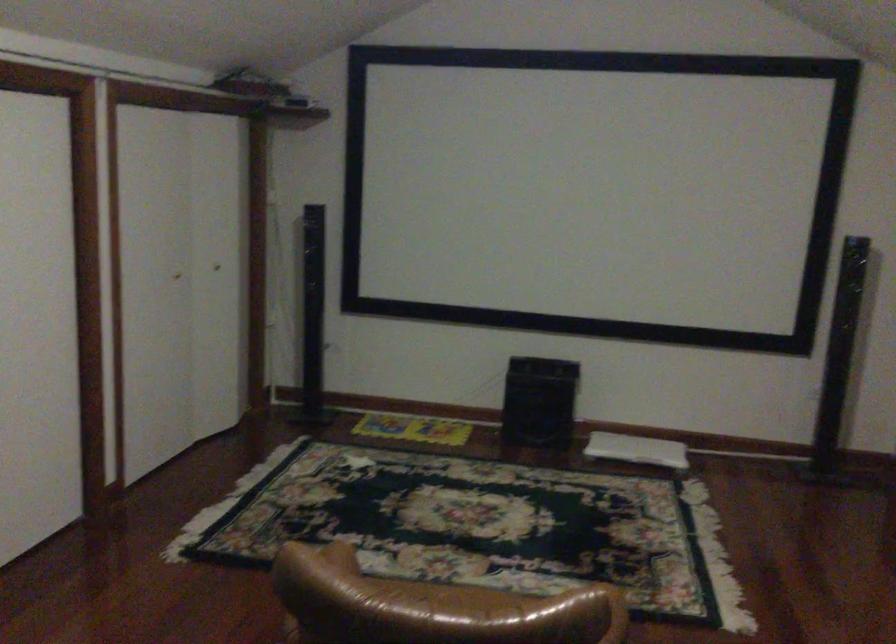
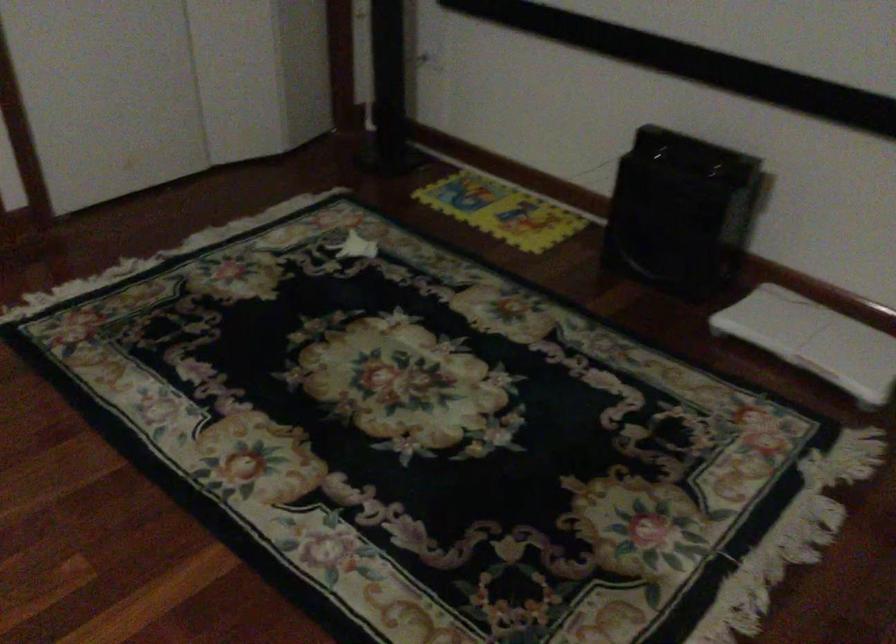
Locate, in the second image, the point that corresponds to (651,444) in the first image.

(814, 339)